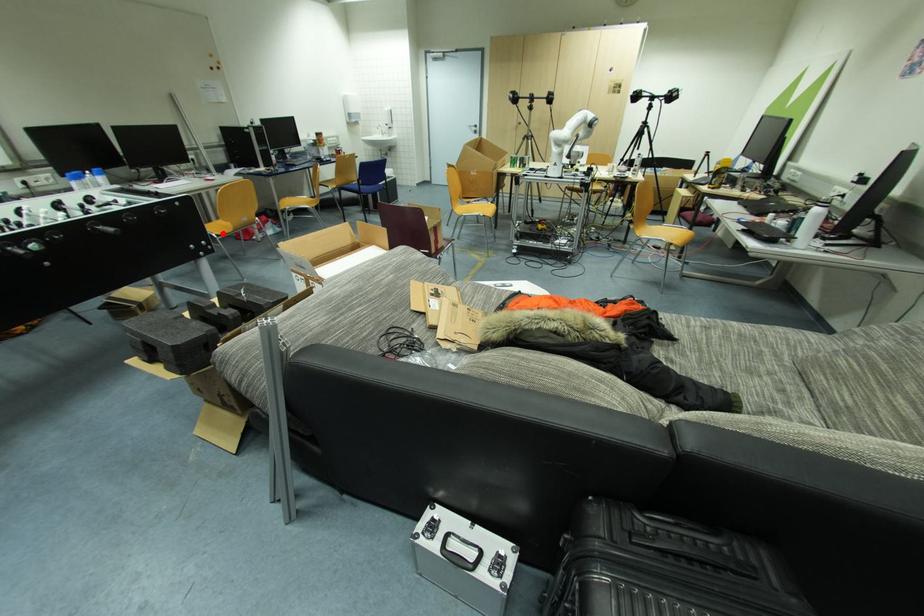
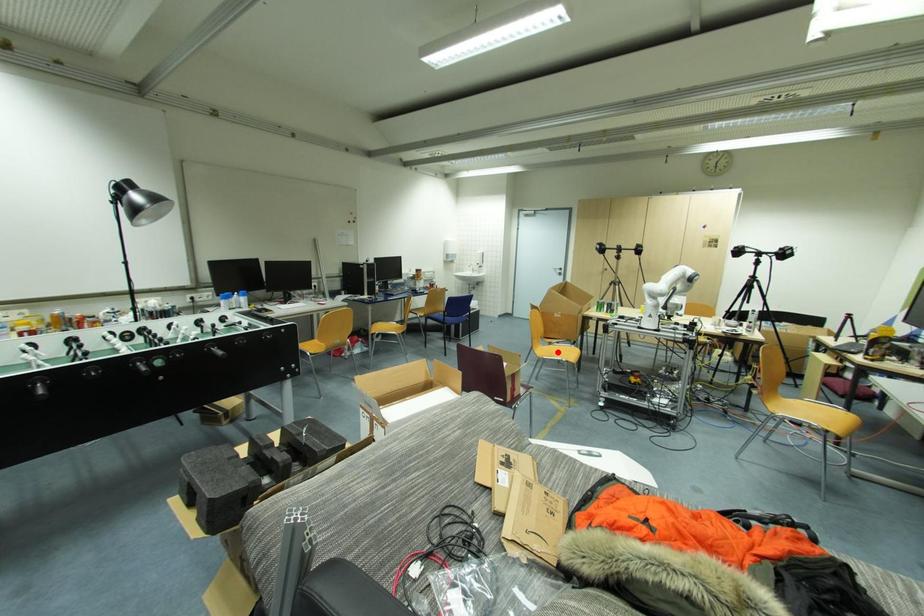
I am providing you with two images of the same scene from different viewpoints. A red point is marked on the first image and another point is marked on the second image. Are the points marked in image1 and image2 representing the same 3D position?

No